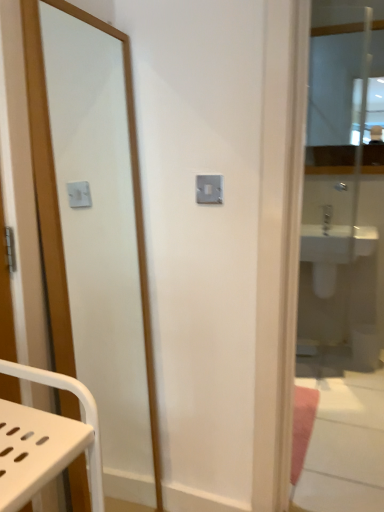
Question: Does matte wooden mirror at left, which is the third mirror in right-to-left order, have a greater height compared to clear glass mirror at upper right, which is the third mirror from front to back?

Choices:
 (A) yes
 (B) no

Answer: (A)

Question: Is matte wooden mirror at left, which is the third mirror in right-to-left order, not near clear glass mirror at upper right, which is the third mirror from front to back?

Choices:
 (A) yes
 (B) no

Answer: (A)

Question: Is matte wooden mirror at left, which is the third mirror in back-to-front order, outside clear glass mirror at upper right, which is the third mirror from front to back?

Choices:
 (A) no
 (B) yes

Answer: (B)

Question: From the image's perspective, does matte wooden mirror at left, which is the third mirror in right-to-left order, appear lower than clear glass mirror at upper right, which appears as the third mirror when viewed from the left?

Choices:
 (A) yes
 (B) no

Answer: (A)

Question: Is matte wooden mirror at left, which is the third mirror in back-to-front order, looking in the opposite direction of clear glass mirror at upper right, placed as the first mirror when sorted from back to front?

Choices:
 (A) no
 (B) yes

Answer: (A)

Question: From a real-world perspective, is matte wooden mirror at left, the 1th mirror positioned from the front, on clear glass mirror at upper right, placed as the first mirror when sorted from back to front?

Choices:
 (A) no
 (B) yes

Answer: (A)

Question: Does white glossy sink at right have a lesser height compared to clear glass mirror at upper right, the first mirror in the right-to-left sequence?

Choices:
 (A) no
 (B) yes

Answer: (B)

Question: Is clear glass mirror at upper right, the first mirror in the right-to-left sequence, inside white glossy sink at right?

Choices:
 (A) no
 (B) yes

Answer: (A)

Question: Is white glossy sink at right bigger than clear glass mirror at upper right, the first mirror in the right-to-left sequence?

Choices:
 (A) yes
 (B) no

Answer: (A)

Question: Considering the relative positions of white glossy sink at right and clear glass mirror at upper right, the first mirror in the right-to-left sequence, in the image provided, is white glossy sink at right to the right of clear glass mirror at upper right, the first mirror in the right-to-left sequence, from the viewer's perspective?

Choices:
 (A) yes
 (B) no

Answer: (B)

Question: Is white glossy sink at right turned away from clear glass mirror at upper right, which appears as the third mirror when viewed from the left?

Choices:
 (A) yes
 (B) no

Answer: (B)

Question: From the image's perspective, is white glossy sink at right below clear glass mirror at upper right, placed as the first mirror when sorted from back to front?

Choices:
 (A) yes
 (B) no

Answer: (A)

Question: Is clear glass mirror at right, placed as the second mirror when sorted from right to left, looking in the opposite direction of white glossy sink at right?

Choices:
 (A) no
 (B) yes

Answer: (B)